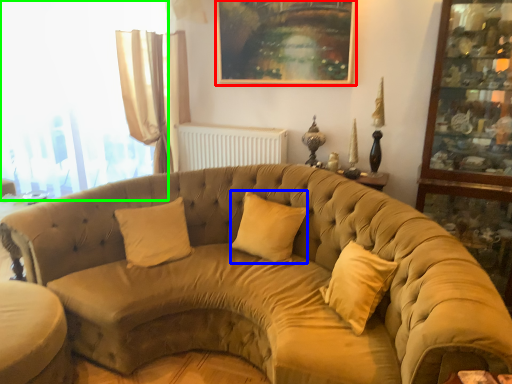
Question: Which object is the closest to the picture frame (highlighted by a red box)? Choose among these: pillow (highlighted by a blue box) or window (highlighted by a green box).

Choices:
 (A) pillow
 (B) window

Answer: (A)